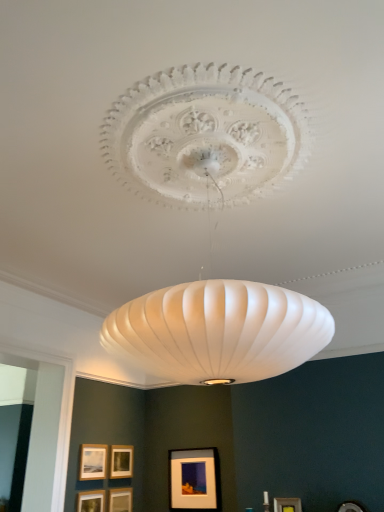
Question: From the image's perspective, does matte gold picture frame at lower center, which is the fifth picture frame from right to left, appear higher than matte gold picture frame at center, which ranks as the 3th picture frame in left-to-right order?

Choices:
 (A) yes
 (B) no

Answer: (B)

Question: Is matte gold picture frame at lower center, which is the fifth picture frame from right to left, touching matte gold picture frame at center, acting as the 4th picture frame starting from the right?

Choices:
 (A) no
 (B) yes

Answer: (A)

Question: Is matte gold picture frame at lower center, which is the fifth picture frame from right to left, looking in the opposite direction of matte gold picture frame at center, acting as the 4th picture frame starting from the right?

Choices:
 (A) no
 (B) yes

Answer: (A)

Question: Considering the relative sizes of matte gold picture frame at lower center, which is counted as the second picture frame, starting from the left, and matte gold picture frame at center, which ranks as the 3th picture frame in left-to-right order, in the image provided, is matte gold picture frame at lower center, which is counted as the second picture frame, starting from the left, shorter than matte gold picture frame at center, which ranks as the 3th picture frame in left-to-right order,?

Choices:
 (A) yes
 (B) no

Answer: (B)

Question: From the image's perspective, is matte gold picture frame at lower center, which is counted as the second picture frame, starting from the left, below matte gold picture frame at center, which ranks as the 3th picture frame in left-to-right order?

Choices:
 (A) yes
 (B) no

Answer: (A)

Question: Is matte black picture frame at lower center, marked as the fifth picture frame in a left-to-right arrangement, inside the boundaries of matte gold picture frame at lower center, the 1th picture frame when ordered from right to left, or outside?

Choices:
 (A) outside
 (B) inside

Answer: (A)

Question: Is point (198, 475) positioned closer to the camera than point (276, 498)?

Choices:
 (A) farther
 (B) closer

Answer: (A)

Question: From their relative heights in the image, would you say matte black picture frame at lower center, marked as the fifth picture frame in a left-to-right arrangement, is taller or shorter than matte gold picture frame at lower center, the 1th picture frame when ordered from right to left?

Choices:
 (A) short
 (B) tall

Answer: (B)

Question: Relative to matte gold picture frame at lower center, marked as the sixth picture frame in a left-to-right arrangement, is matte black picture frame at lower center, marked as the fifth picture frame in a left-to-right arrangement, in front or behind?

Choices:
 (A) behind
 (B) front

Answer: (A)

Question: From a real-world perspective, is matte gold picture frame at lower center, the 1th picture frame when ordered from right to left, positioned above or below wooden picture frame at lower center, the 3th picture frame positioned from the right?

Choices:
 (A) above
 (B) below

Answer: (B)

Question: In the image, is matte gold picture frame at lower center, marked as the sixth picture frame in a left-to-right arrangement, positioned in front of or behind wooden picture frame at lower center, the 3th picture frame positioned from the right?

Choices:
 (A) behind
 (B) front

Answer: (B)

Question: Considering the positions of matte gold picture frame at lower center, marked as the sixth picture frame in a left-to-right arrangement, and wooden picture frame at lower center, the 3th picture frame positioned from the right, in the image, is matte gold picture frame at lower center, marked as the sixth picture frame in a left-to-right arrangement, taller or shorter than wooden picture frame at lower center, the 3th picture frame positioned from the right,?

Choices:
 (A) short
 (B) tall

Answer: (A)

Question: Would you say matte gold picture frame at lower center, the 1th picture frame when ordered from right to left, is inside or outside wooden picture frame at lower center, the 3th picture frame positioned from the right?

Choices:
 (A) outside
 (B) inside

Answer: (A)

Question: From a real-world perspective, is matte gold picture frame at lower center, the 1th picture frame when ordered from right to left, physically located above or below matte gold picture frame at lower left, which appears as the sixth picture frame when viewed from the right?

Choices:
 (A) above
 (B) below

Answer: (B)

Question: Is point (289, 499) positioned closer to the camera than point (79, 478)?

Choices:
 (A) closer
 (B) farther

Answer: (A)